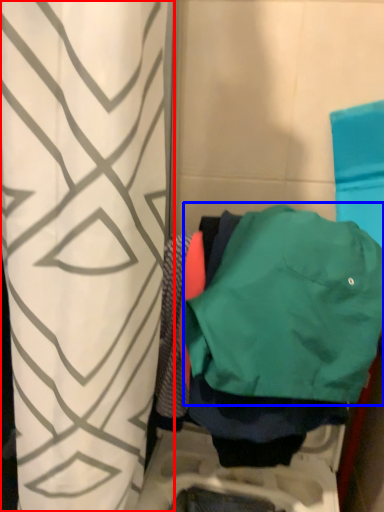
Question: Which object is further to the camera taking this photo, curtain (highlighted by a red box) or jacket (highlighted by a blue box)?

Choices:
 (A) curtain
 (B) jacket

Answer: (B)